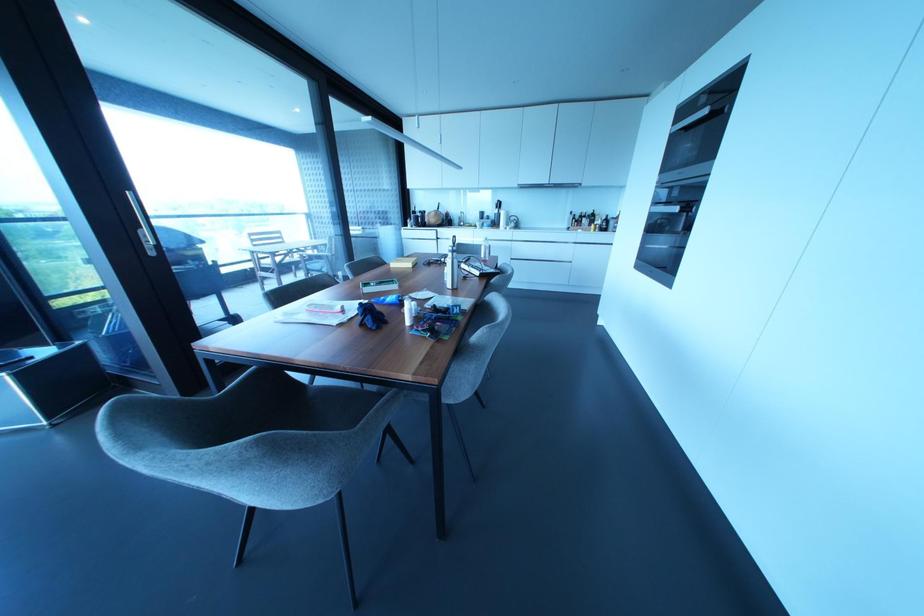
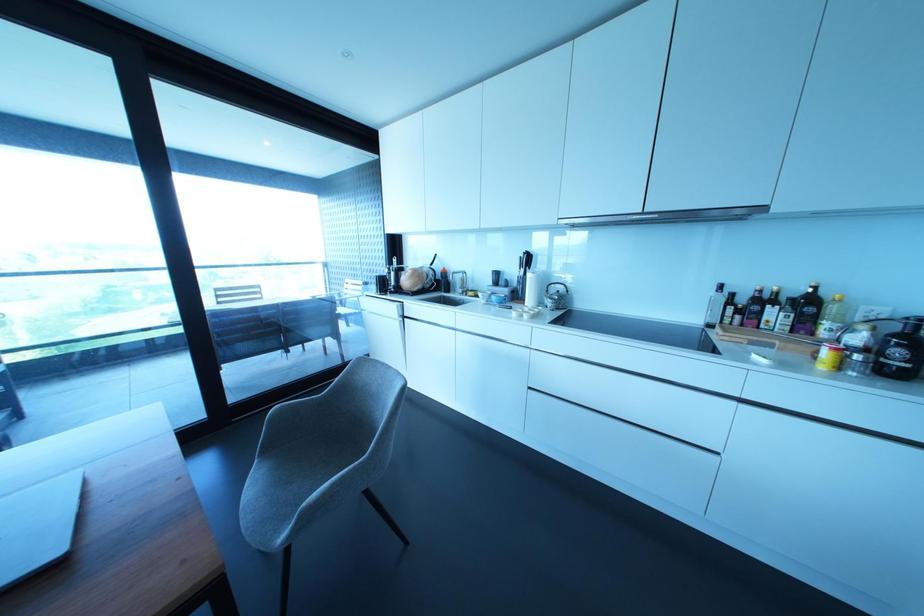
Where in the second image is the point corresponding to point 591,225 from the first image?

(825, 353)